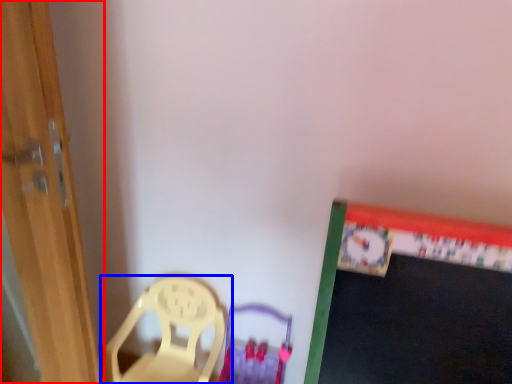
Question: Which point is closer to the camera, door (highlighted by a red box) or chair (highlighted by a blue box)?

Choices:
 (A) door
 (B) chair

Answer: (A)